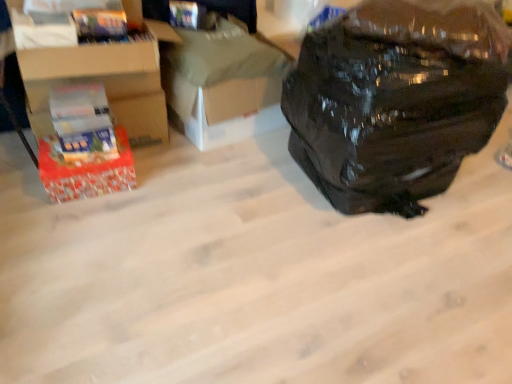
Question: In terms of width, does white cardboard box at center, which is the first cardboard box in right-to-left order, look wider or thinner when compared to red cardboard box at left?

Choices:
 (A) thin
 (B) wide

Answer: (B)

Question: Which is correct: white cardboard box at center, which is the first cardboard box in right-to-left order, is inside red cardboard box at left, or outside of it?

Choices:
 (A) outside
 (B) inside

Answer: (A)

Question: Which object is the farthest from the white cardboard box at center, marked as the second cardboard box in a left-to-right arrangement?

Choices:
 (A) cardboard box at left, the first cardboard box in the left-to-right sequence
 (B) black matte backpack at right
 (C) red cardboard box at left

Answer: (B)

Question: Based on their relative distances, which object is nearer to the cardboard box at left, placed as the 2th cardboard box when sorted from right to left?

Choices:
 (A) white cardboard box at center, which is the first cardboard box in right-to-left order
 (B) black matte backpack at right
 (C) red cardboard box at left

Answer: (C)